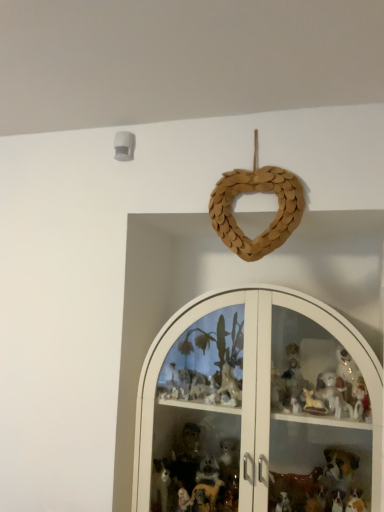
Question: From the image's perspective, relative to braided wood heart at upper center, is white glass cabinet at center above or below?

Choices:
 (A) below
 (B) above

Answer: (A)

Question: Based on their positions, is white glass cabinet at center located to the left or right of braided wood heart at upper center?

Choices:
 (A) left
 (B) right

Answer: (B)

Question: Which is correct: white glass cabinet at center is inside braided wood heart at upper center, or outside of it?

Choices:
 (A) outside
 (B) inside

Answer: (A)

Question: From the image's perspective, relative to white glass cabinet at center, is braided wood heart at upper center above or below?

Choices:
 (A) below
 (B) above

Answer: (B)

Question: Looking at their shapes, would you say braided wood heart at upper center is wider or thinner than white glass cabinet at center?

Choices:
 (A) wide
 (B) thin

Answer: (B)

Question: Is point (292, 215) closer or farther from the camera than point (218, 358)?

Choices:
 (A) closer
 (B) farther

Answer: (A)

Question: From a real-world perspective, is braided wood heart at upper center physically located above or below white glass cabinet at center?

Choices:
 (A) above
 (B) below

Answer: (A)